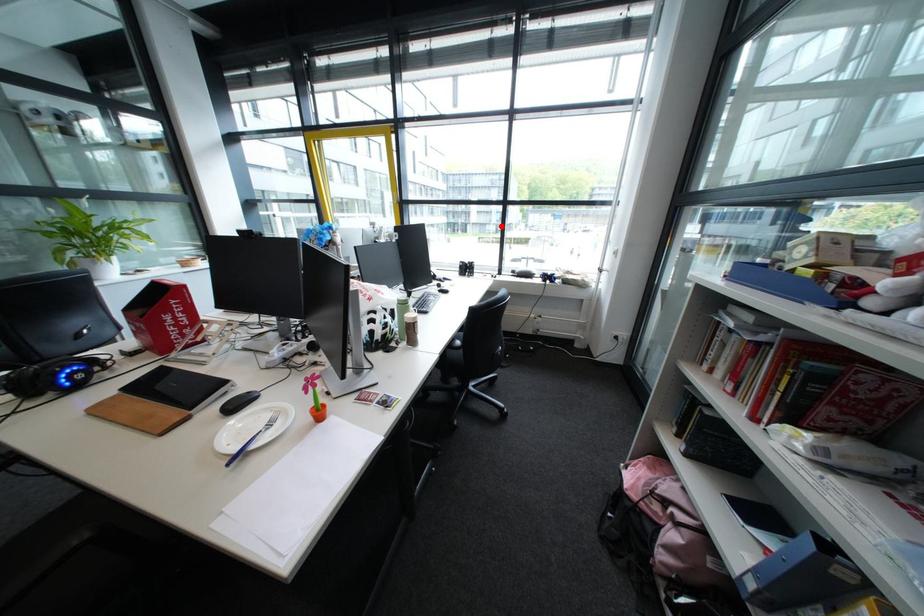
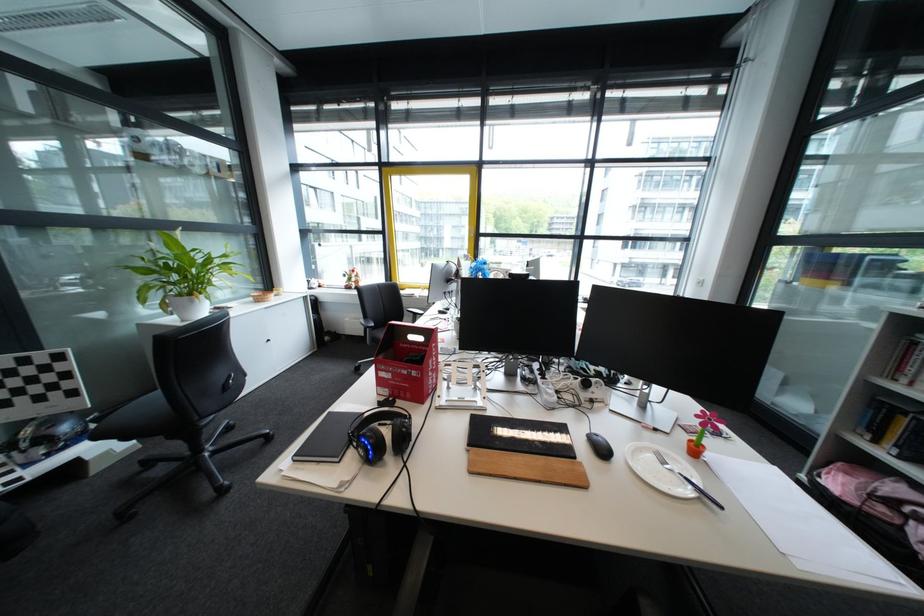
Find the pixel in the second image that matches the highlighted location in the first image.

(472, 251)